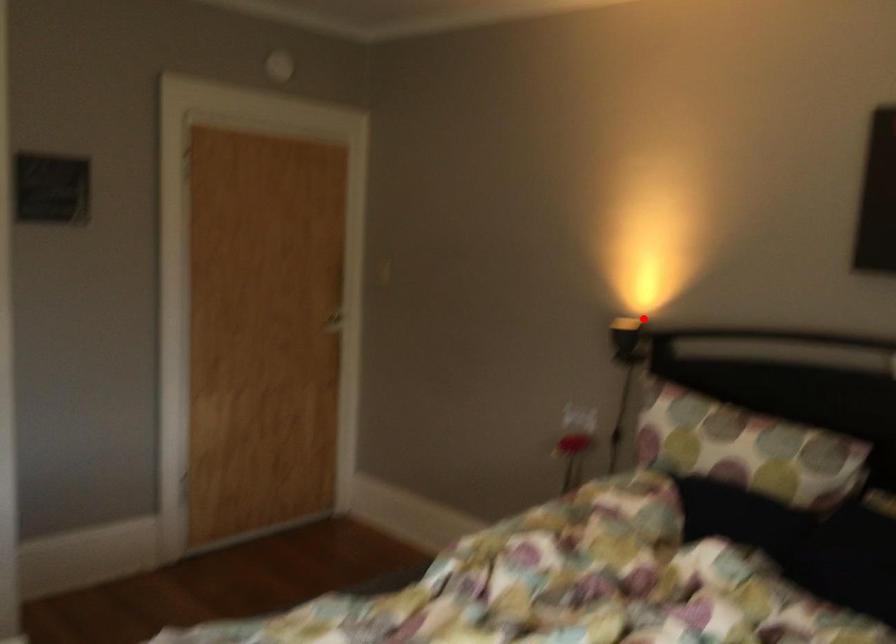
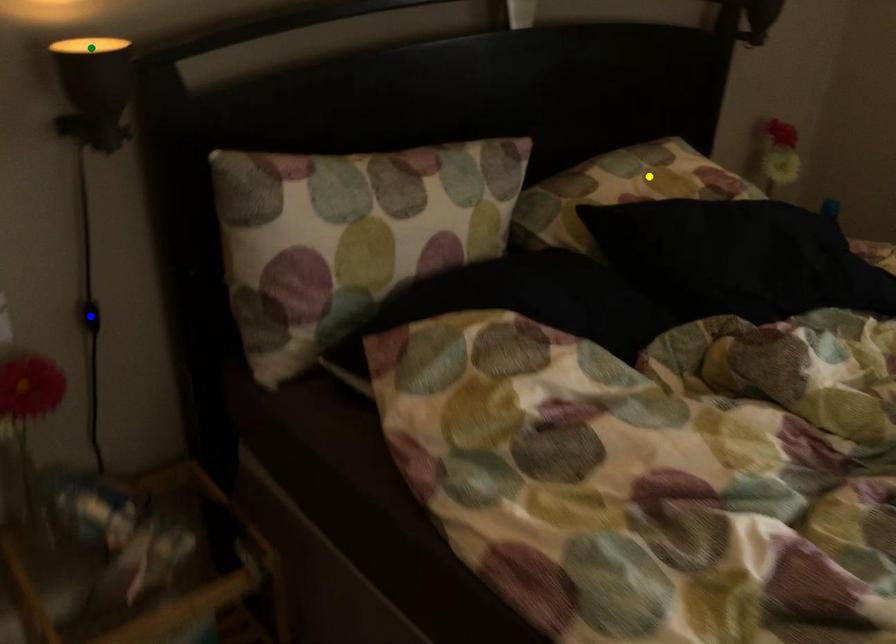
Question: I am providing you with two images of the same scene from different viewpoints. A red point is marked on the first image. You are given multiple points on the second image. In image 2, which mark is for the same physical point as the one in image 1?

Choices:
 (A) yellow point
 (B) blue point
 (C) green point

Answer: (C)